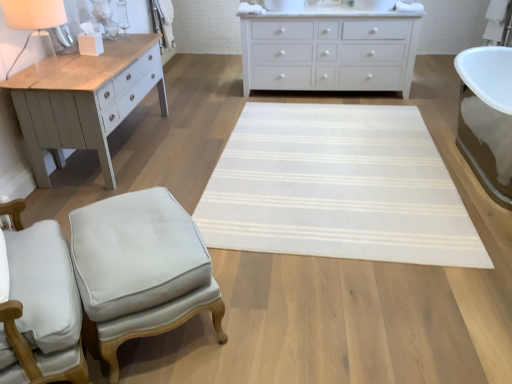
Locate an element on the screen. free location to the left of white matte chest of drawers at upper center is located at coordinates (218, 106).